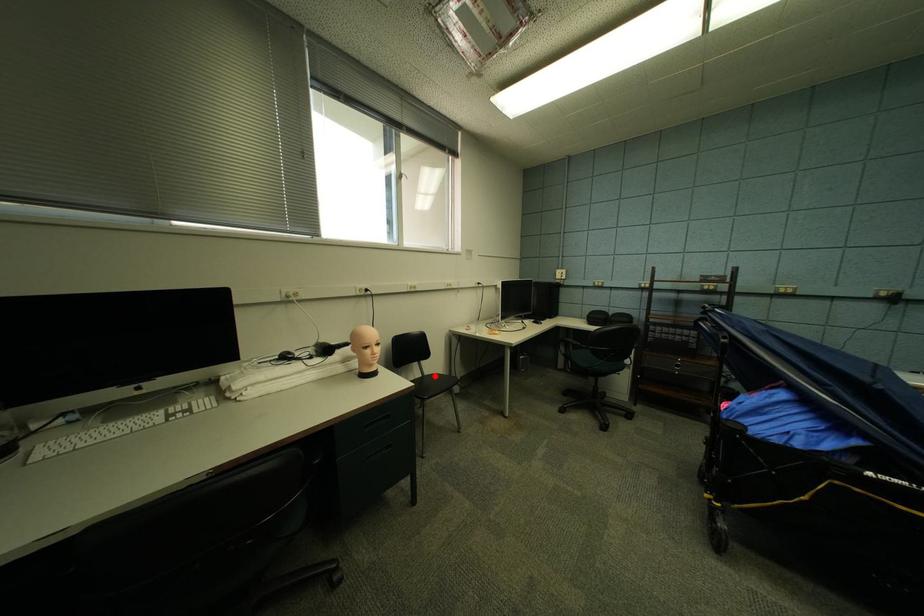
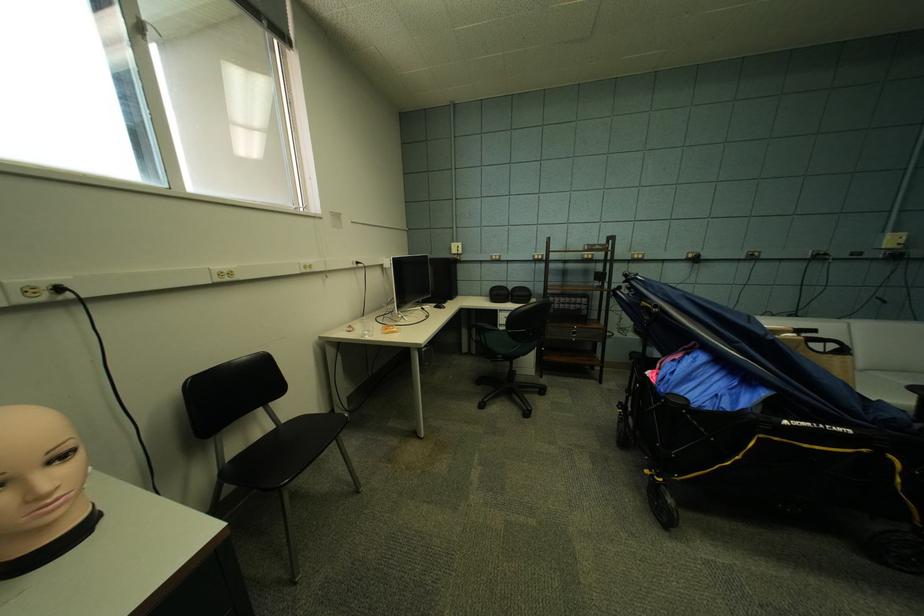
The point at the highlighted location is marked in the first image. Where is the corresponding point in the second image?

(292, 424)